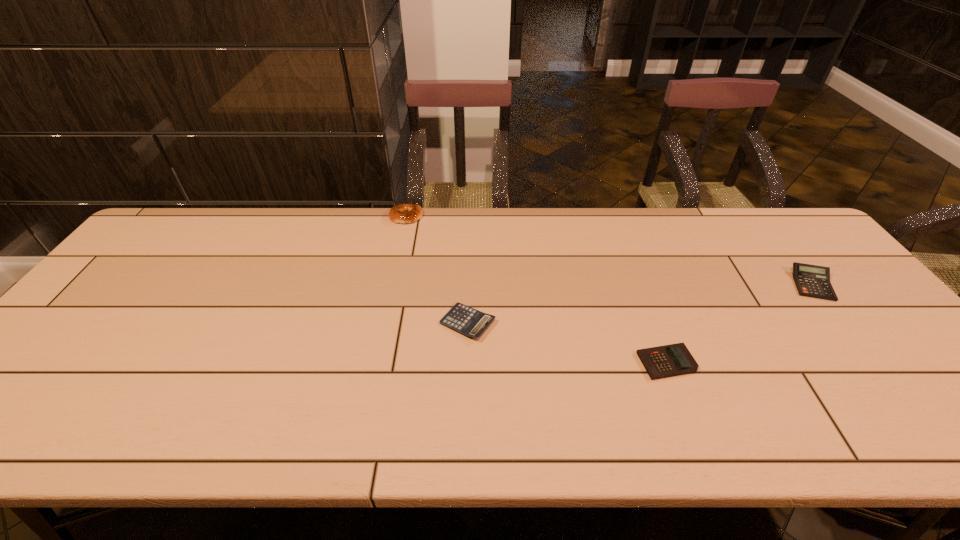
This screenshot has width=960, height=540. In order to click on unoccupied area between the rightmost calculator and the second calculator from right to left in this screenshot , I will do `click(739, 323)`.

Locate an element on the screen. The height and width of the screenshot is (540, 960). blank region between the third nearest object and the third farthest object is located at coordinates (639, 303).

You are a GUI agent. You are given a task and a screenshot of the screen. Output one action in this format:
    pyautogui.click(x=<x>, y=<y>)
    Task: Click on the free space that is in between the leftmost calculator and the farthest object
    The height and width of the screenshot is (540, 960).
    Given the screenshot: What is the action you would take?
    pyautogui.click(x=437, y=269)

Find the location of a particular element. free space that is in between the rightmost object and the leftmost calculator is located at coordinates (639, 303).

In order to click on vacant space that is in between the second farthest calculator and the bagel in this screenshot , I will do `click(437, 269)`.

The width and height of the screenshot is (960, 540). Identify the location of free space between the second object from right to left and the farthest calculator. (739, 323).

I want to click on free space between the tallest calculator and the second farthest calculator, so click(639, 303).

Where is `vacant space that's between the tallest calculator and the second calculator from right to left`? The image size is (960, 540). vacant space that's between the tallest calculator and the second calculator from right to left is located at coordinates (739, 323).

Find the location of `free space between the nearest object and the leftmost object`. free space between the nearest object and the leftmost object is located at coordinates (537, 289).

Image resolution: width=960 pixels, height=540 pixels. What are the coordinates of `object that is the nearest to the nearest calculator` in the screenshot? It's located at (468, 321).